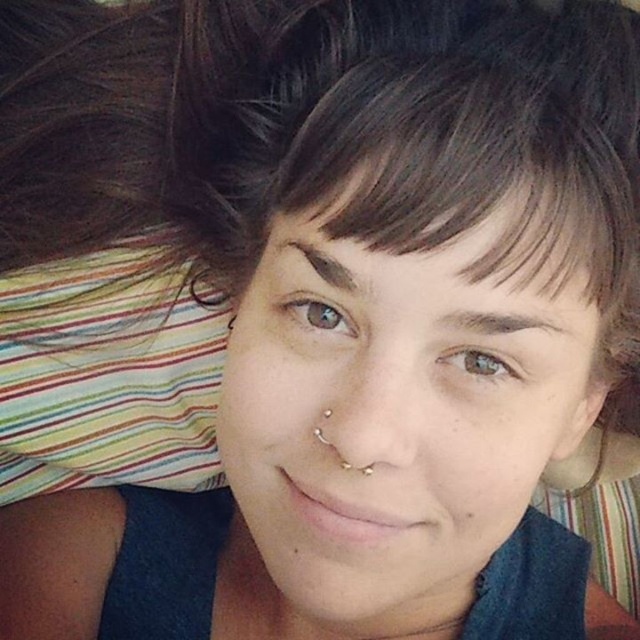
Question: Where is smooth skin face at center located in relation to brown matte hair at center in the image?

Choices:
 (A) above
 (B) below

Answer: (B)

Question: Is smooth skin face at center below brown matte hair at center?

Choices:
 (A) yes
 (B) no

Answer: (A)

Question: Which of the following is the farthest from the observer?

Choices:
 (A) smooth skin face at center
 (B) brown matte hair at center

Answer: (A)

Question: Among these objects, which one is farthest from the camera?

Choices:
 (A) smooth skin face at center
 (B) brown matte hair at center

Answer: (A)

Question: Does smooth skin face at center have a lesser width compared to brown matte hair at center?

Choices:
 (A) yes
 (B) no

Answer: (B)